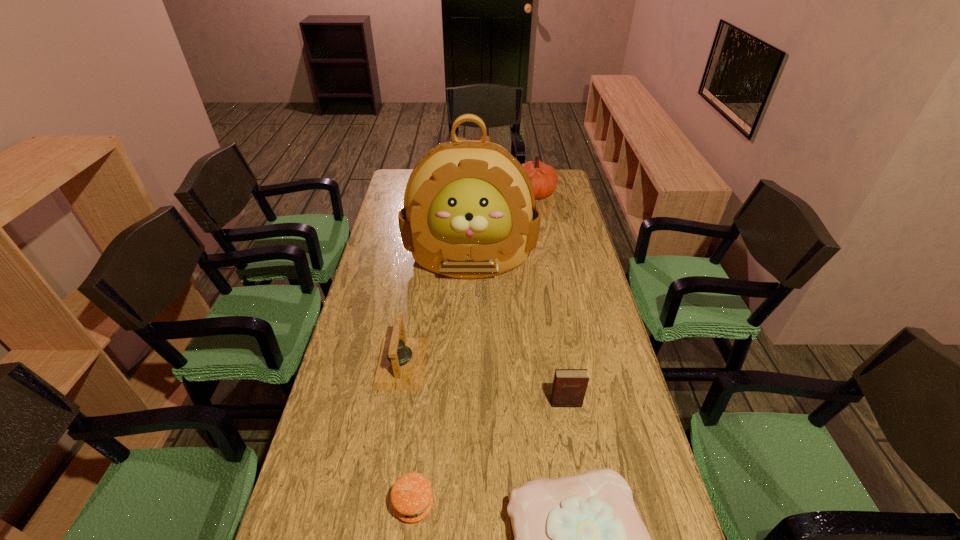
In the image, there is a desktop. Identify the location of vacant space at the left edge. The height and width of the screenshot is (540, 960). [362, 467].

Find the location of a particular element. This screenshot has width=960, height=540. free space at the right edge of the desktop is located at coordinates (554, 252).

You are a GUI agent. You are given a task and a screenshot of the screen. Output one action in this format:
    pyautogui.click(x=<x>, y=<y>)
    Task: Click on the vacant point located between the third nearest object and the shortest object
    
    Given the screenshot: What is the action you would take?
    (490, 454)

Where is `free space between the third farthest object and the patty`? free space between the third farthest object and the patty is located at coordinates (408, 434).

At what (x,y) coordinates should I click in order to perform the action: click on free space between the patty and the bell. Please return your answer as a coordinate pair (x, y). Looking at the image, I should click on (x=408, y=434).

This screenshot has width=960, height=540. I want to click on blank region between the backpack and the diary, so click(x=518, y=330).

The image size is (960, 540). In order to click on vacant point located between the fifth shortest object and the third nearest object in this screenshot , I will do `click(550, 298)`.

Identify the location of vacant area that lies between the bell and the shortest object. (408, 434).

Where is `object that is the fourth closest to the bell`? object that is the fourth closest to the bell is located at coordinates tap(569, 387).

Point out which object is positioned as the third nearest to the cake. Please provide its 2D coordinates. Your answer should be formatted as a tuple, i.e. [(x, y)], where the tuple contains the x and y coordinates of a point satisfying the conditions above.

[(401, 363)]